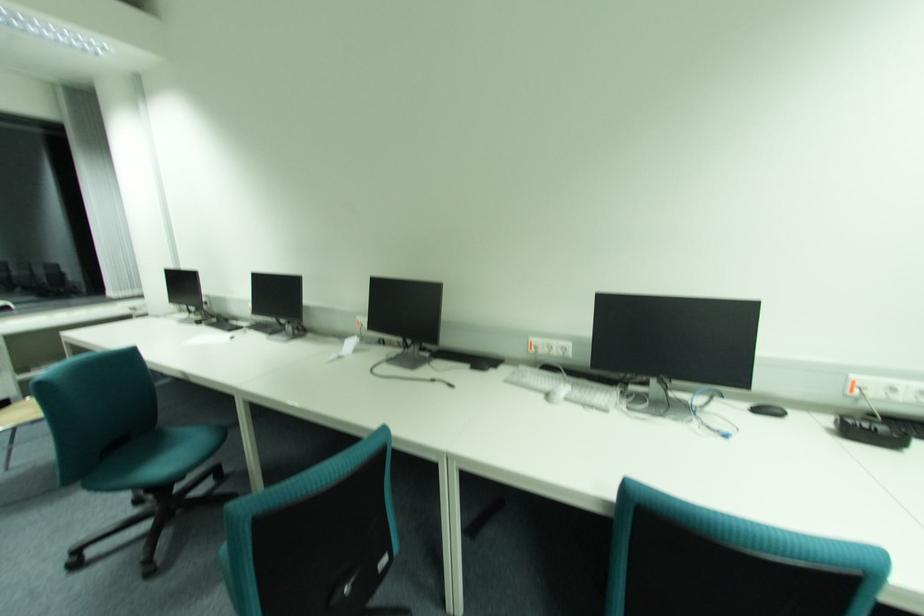
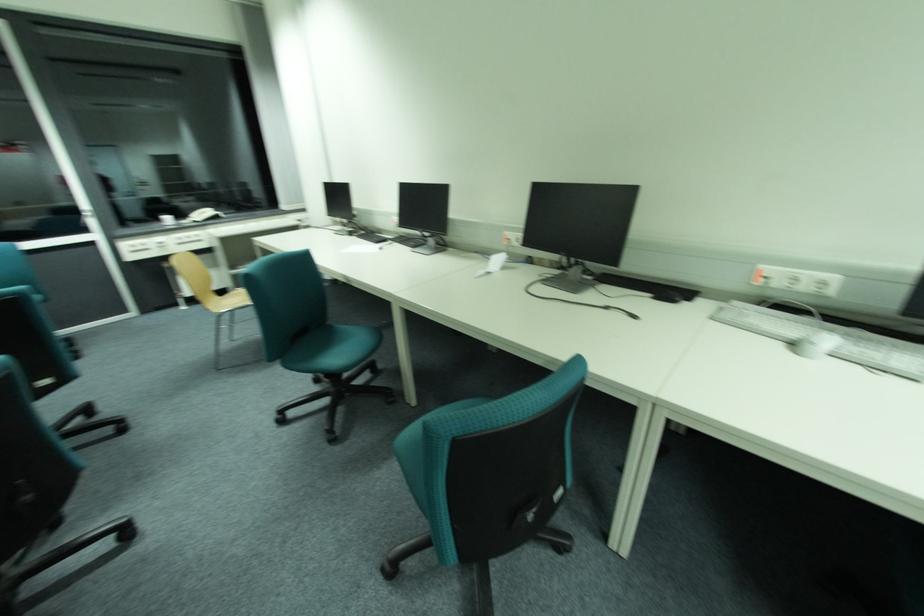
The point at (x=553, y=395) is marked in the first image. Where is the corresponding point in the second image?

(800, 345)